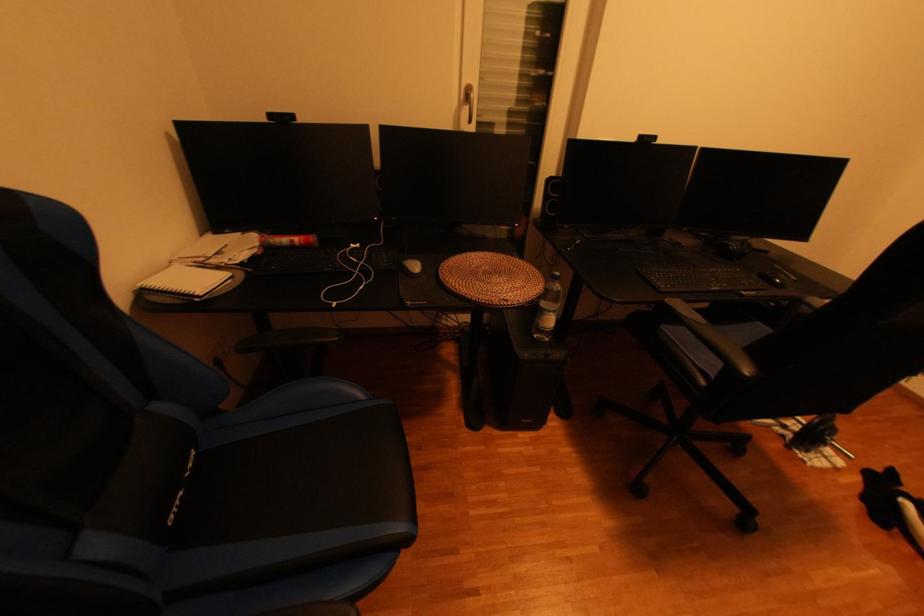
This screenshot has width=924, height=616. I want to click on black webcam, so click(281, 116).